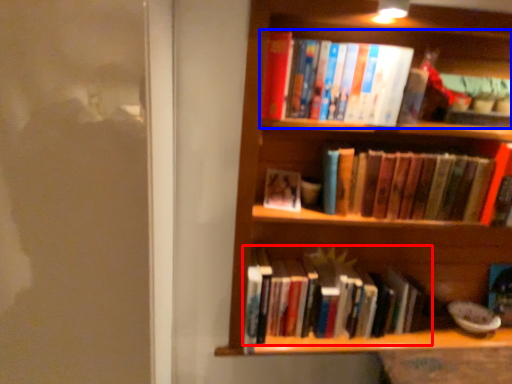
Question: Among these objects, which one is nearest to the camera, book (highlighted by a red box) or book (highlighted by a blue box)?

Choices:
 (A) book
 (B) book

Answer: (B)